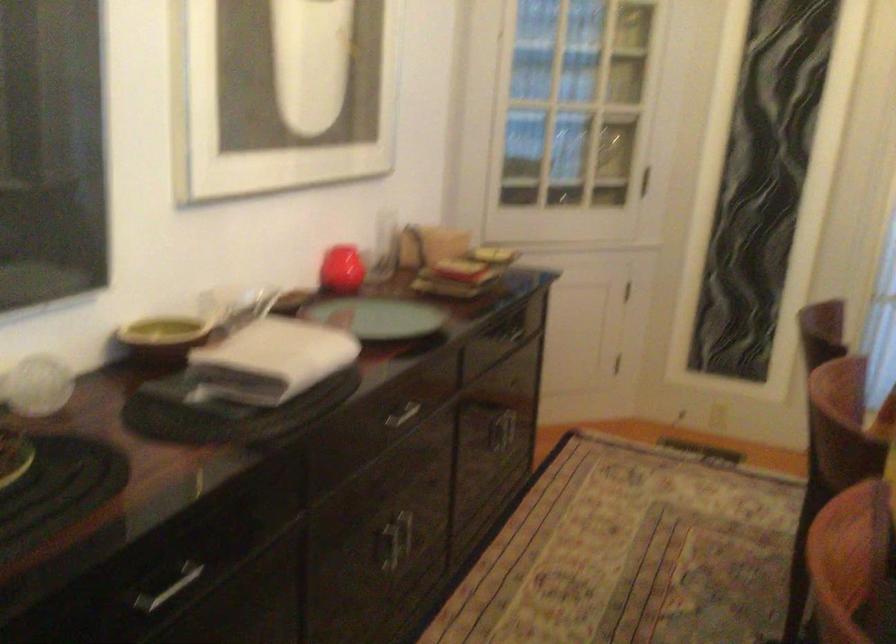
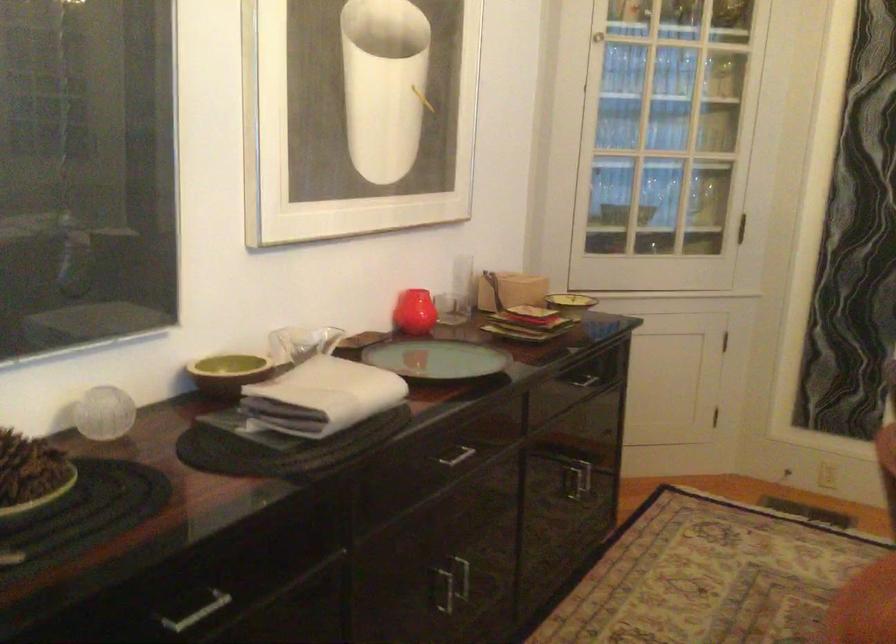
The point at (391, 544) is marked in the first image. Where is the corresponding point in the second image?

(443, 589)